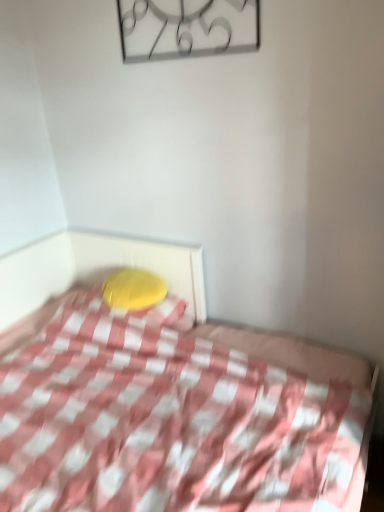
In order to click on yellow fabric pillow at center in this screenshot , I will do `click(133, 289)`.

Identify the location of metallic clock at upper center. (187, 28).

Image resolution: width=384 pixels, height=512 pixels. I want to click on yellow fabric pillow at center, so click(133, 289).

Considering the sizes of objects yellow fabric pillow at center and metallic clock at upper center in the image provided, who is bigger, yellow fabric pillow at center or metallic clock at upper center?

With larger size is yellow fabric pillow at center.

How many degrees apart are the facing directions of yellow fabric pillow at center and metallic clock at upper center?

6.69 degrees.

From the image's perspective, is yellow fabric pillow at center positioned above or below metallic clock at upper center?

yellow fabric pillow at center is below metallic clock at upper center.

In the scene shown: Between yellow fabric pillow at center and metallic clock at upper center, which one has larger width?

With larger width is yellow fabric pillow at center.

From a real-world perspective, is metallic clock at upper center located higher than pink checkered fabric at center?

Yes, from a real-world perspective, metallic clock at upper center is above pink checkered fabric at center.

Is metallic clock at upper center facing away from pink checkered fabric at center?

No.

Consider the image. Does metallic clock at upper center appear on the right side of pink checkered fabric at center?

Indeed, metallic clock at upper center is positioned on the right side of pink checkered fabric at center.

Considering the positions of point (178, 341) and point (149, 295), is point (178, 341) closer or farther from the camera than point (149, 295)?

Point (178, 341).

Looking at this image, who is smaller, pink checkered fabric at center or yellow fabric pillow at center?

Smaller between the two is yellow fabric pillow at center.

How far apart are pink checkered fabric at center and yellow fabric pillow at center?

pink checkered fabric at center is 17.85 inches away from yellow fabric pillow at center.

Between pink checkered fabric at center and yellow fabric pillow at center, which one appears on the left side from the viewer's perspective?

From the viewer's perspective, yellow fabric pillow at center appears more on the left side.

Looking at their sizes, would you say metallic clock at upper center is wider or thinner than yellow fabric pillow at center?

Clearly, metallic clock at upper center has less width compared to yellow fabric pillow at center.

From the picture: Are metallic clock at upper center and yellow fabric pillow at center located far from each other?

That's right, there is a large distance between metallic clock at upper center and yellow fabric pillow at center.

Is metallic clock at upper center smaller than yellow fabric pillow at center?

Yes.

Considering the positions of objects metallic clock at upper center and yellow fabric pillow at center in the image provided, who is more to the right, metallic clock at upper center or yellow fabric pillow at center?

Positioned to the right is metallic clock at upper center.

Does pink checkered fabric at center turn towards metallic clock at upper center?

No, pink checkered fabric at center is not turned towards metallic clock at upper center.

Would you consider pink checkered fabric at center to be distant from metallic clock at upper center?

That's right, there is a large distance between pink checkered fabric at center and metallic clock at upper center.

Considering the relative sizes of pink checkered fabric at center and metallic clock at upper center in the image provided, is pink checkered fabric at center shorter than metallic clock at upper center?

No, pink checkered fabric at center is not shorter than metallic clock at upper center.

Can you confirm if pink checkered fabric at center is bigger than metallic clock at upper center?

Indeed, pink checkered fabric at center has a larger size compared to metallic clock at upper center.

Is yellow fabric pillow at center oriented away from pink checkered fabric at center?

Absolutely, yellow fabric pillow at center is directed away from pink checkered fabric at center.

Which is nearer, (147, 284) or (135, 262)?

Point (147, 284) appears to be closer to the viewer than point (135, 262).

Is yellow fabric pillow at center inside the boundaries of pink checkered fabric at center, or outside?

yellow fabric pillow at center is located inside pink checkered fabric at center.

From a real-world perspective, does yellow fabric pillow at center sit lower than pink checkered fabric at center?

Incorrect, from a real-world perspective, yellow fabric pillow at center is higher than pink checkered fabric at center.

You are a GUI agent. You are given a task and a screenshot of the screen. Output one action in this format:
    pyautogui.click(x=<x>, y=<y>)
    Task: Click on the design that appears above the yellow fabric pillow at center (from the image's perspective)
    The image size is (384, 512).
    Given the screenshot: What is the action you would take?
    pyautogui.click(x=187, y=28)

Find the location of a particular element. bed on the left of metallic clock at upper center is located at coordinates (175, 418).

Which object lies nearer to the anchor point metallic clock at upper center, pink checkered fabric at center or yellow fabric pillow at center?

yellow fabric pillow at center is closer to metallic clock at upper center.

Estimate the real-world distances between objects in this image. Which object is closer to pink checkered fabric at center, yellow fabric pillow at center or metallic clock at upper center?

yellow fabric pillow at center is positioned closer to the anchor pink checkered fabric at center.

Estimate the real-world distances between objects in this image. Which object is further from pink checkered fabric at center, metallic clock at upper center or yellow fabric pillow at center?

Based on the image, metallic clock at upper center appears to be further to pink checkered fabric at center.

Considering their positions, is yellow fabric pillow at center positioned closer to metallic clock at upper center than pink checkered fabric at center?

Based on the image, yellow fabric pillow at center appears to be nearer to metallic clock at upper center.

Looking at the image, which one is located further to yellow fabric pillow at center, pink checkered fabric at center or metallic clock at upper center?

Based on the image, metallic clock at upper center appears to be further to yellow fabric pillow at center.

From the image, which object appears to be farther from yellow fabric pillow at center, metallic clock at upper center or pink checkered fabric at center?

metallic clock at upper center is further to yellow fabric pillow at center.

The image size is (384, 512). Identify the location of pillow between metallic clock at upper center and pink checkered fabric at center in the vertical direction. (133, 289).